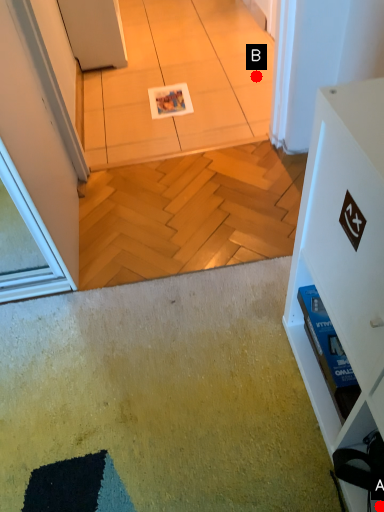
Question: Two points are circled on the image, labeled by A and B beside each circle. Which point is closer to the camera?

Choices:
 (A) A is closer
 (B) B is closer

Answer: (A)